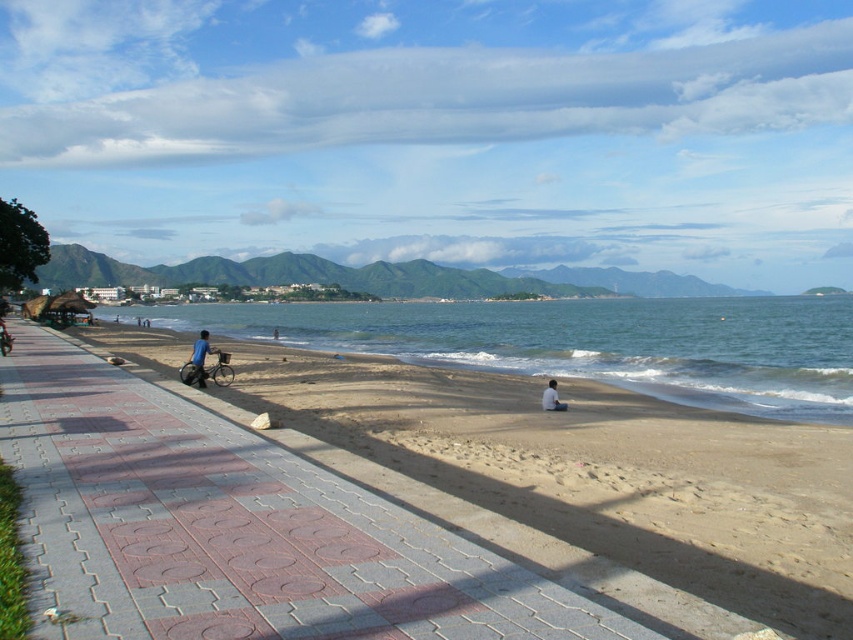
Question: Which point appears farthest from the camera in this image?

Choices:
 (A) (183, 380)
 (B) (480, 392)

Answer: (B)

Question: Is sandy beach at lower left below light brown sand at lower center?

Choices:
 (A) no
 (B) yes

Answer: (A)

Question: Which object appears farthest from the camera in this image?

Choices:
 (A) greenish-blue water at center
 (B) sandy beach at lower left
 (C) light brown sand at lower center

Answer: (A)

Question: Is blue fabric shirt at center thinner than light brown sand at lower center?

Choices:
 (A) yes
 (B) no

Answer: (B)

Question: From the image, what is the correct spatial relationship of sandy beach at lower left in relation to greenish-blue water at center?

Choices:
 (A) left
 (B) right

Answer: (A)

Question: Based on their relative distances, which object is nearer to the sandy beach at lower left?

Choices:
 (A) blue fabric shirt at center
 (B) light brown sand at lower center
 (C) greenish-blue water at center

Answer: (A)